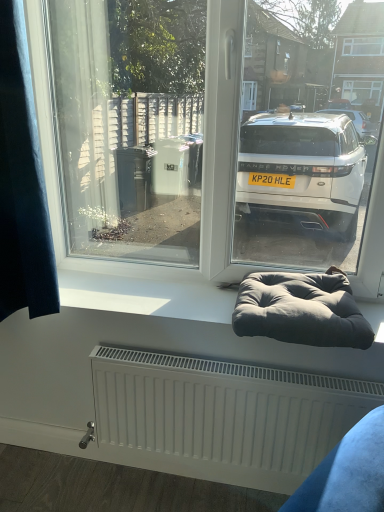
Measure the distance between white matte window sill at center and camera.

white matte window sill at center and camera are 4.47 feet apart.

This screenshot has width=384, height=512. I want to click on dark blue fabric at left, so click(22, 182).

Image resolution: width=384 pixels, height=512 pixels. I want to click on white matte window sill at center, so click(143, 290).

Consider the image. Does dark blue fabric at left have a greater width compared to white matte window sill at center?

No.

From a real-world perspective, is dark blue fabric at left located beneath white matte window sill at center?

No, from a real-world perspective, dark blue fabric at left is not below white matte window sill at center.

Consider the image. Is dark blue fabric at left placed right next to white matte window sill at center?

No.

Based on the photo, considering the sizes of objects dark blue fabric at left and dark gray fabric bean bag at lower center in the image provided, who is smaller, dark blue fabric at left or dark gray fabric bean bag at lower center?

dark gray fabric bean bag at lower center.

At what (x,y) coordinates should I click in order to perform the action: click on bean bag chair below the dark blue fabric at left (from the image's perspective). Please return your answer as a coordinate pair (x, y). Looking at the image, I should click on (301, 309).

Is dark gray fabric bean bag at lower center surrounded by dark blue fabric at left?

No, dark gray fabric bean bag at lower center is not inside dark blue fabric at left.

Based on the photo, is dark blue fabric at left wider or thinner than dark gray fabric bean bag at lower center?

Clearly, dark blue fabric at left has less width compared to dark gray fabric bean bag at lower center.

From the picture: How distant is dark gray fabric bean bag at lower center from white matte window sill at center?

dark gray fabric bean bag at lower center and white matte window sill at center are 12.30 inches apart.

Where is `window sill behind the dark gray fabric bean bag at lower center`? window sill behind the dark gray fabric bean bag at lower center is located at coordinates (x=143, y=290).

Is dark gray fabric bean bag at lower center beside white matte window sill at center?

dark gray fabric bean bag at lower center and white matte window sill at center are clearly separated.

Is dark gray fabric bean bag at lower center bigger than white matte window sill at center?

Indeed, dark gray fabric bean bag at lower center has a larger size compared to white matte window sill at center.

Can you confirm if dark gray fabric bean bag at lower center is shorter than dark blue fabric at left?

Indeed, dark gray fabric bean bag at lower center has a lesser height compared to dark blue fabric at left.

Is dark gray fabric bean bag at lower center positioned behind dark blue fabric at left?

That is True.

From the image's perspective, would you say dark gray fabric bean bag at lower center is shown under dark blue fabric at left?

Yes.

Considering the relative sizes of white matte window sill at center and dark gray fabric bean bag at lower center in the image provided, is white matte window sill at center taller than dark gray fabric bean bag at lower center?

No.

Is white matte window sill at center in contact with dark gray fabric bean bag at lower center?

white matte window sill at center and dark gray fabric bean bag at lower center are clearly separated.

Does point (211, 313) lie in front of point (273, 336)?

That is False.

Between white matte window sill at center and dark blue fabric at left, which one has smaller width?

dark blue fabric at left.

Between white matte window sill at center and dark blue fabric at left, which one has smaller size?

With smaller size is white matte window sill at center.

Locate an element on the screen. The height and width of the screenshot is (512, 384). curtain on the left of white matte window sill at center is located at coordinates (22, 182).

From a real-world perspective, is white matte window sill at center over dark blue fabric at left?

Incorrect, from a real-world perspective, white matte window sill at center is lower than dark blue fabric at left.

Identify the location of window sill below the dark blue fabric at left (from a real-world perspective). Image resolution: width=384 pixels, height=512 pixels. (143, 290).

The height and width of the screenshot is (512, 384). Identify the location of curtain in front of the dark gray fabric bean bag at lower center. (22, 182).

From the picture: From the image, which object appears to be farther from dark gray fabric bean bag at lower center, dark blue fabric at left or white matte window sill at center?

dark blue fabric at left.

Estimate the real-world distances between objects in this image. Which object is further from dark gray fabric bean bag at lower center, white matte window sill at center or dark blue fabric at left?

Based on the image, dark blue fabric at left appears to be further to dark gray fabric bean bag at lower center.

Based on the photo, which object lies further to the anchor point white matte window sill at center, dark blue fabric at left or dark gray fabric bean bag at lower center?

The object further to white matte window sill at center is dark blue fabric at left.

Based on their spatial positions, is dark gray fabric bean bag at lower center or white matte window sill at center closer to dark blue fabric at left?

Among the two, white matte window sill at center is located nearer to dark blue fabric at left.

Estimate the real-world distances between objects in this image. Which object is further from white matte window sill at center, dark gray fabric bean bag at lower center or dark blue fabric at left?

Among the two, dark blue fabric at left is located further to white matte window sill at center.

Estimate the real-world distances between objects in this image. Which object is further from dark blue fabric at left, white matte window sill at center or dark gray fabric bean bag at lower center?

dark gray fabric bean bag at lower center is positioned further to the anchor dark blue fabric at left.

Identify the location of window sill situated between dark blue fabric at left and dark gray fabric bean bag at lower center from left to right. This screenshot has width=384, height=512. (143, 290).